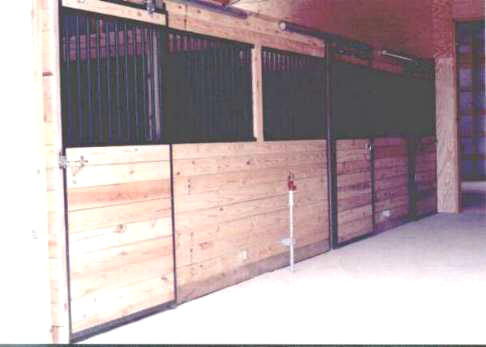
Identify the location of wood divider between bars. (256, 84).